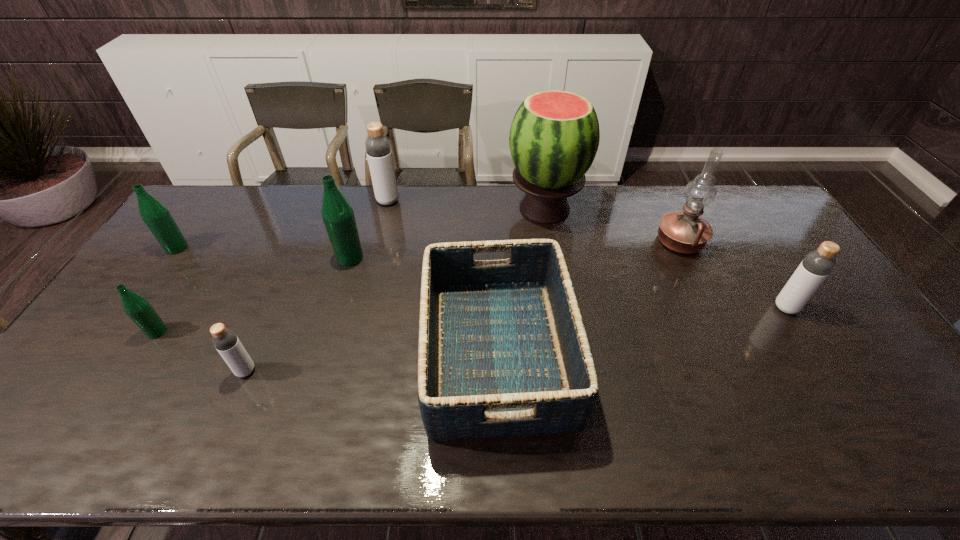
The width and height of the screenshot is (960, 540). I want to click on vacant region at the far left corner of the desktop, so click(225, 187).

Identify the location of vacant position at the near right corner of the desktop. coord(881,425).

Where is `free area in between the basket and the oil lamp`? Image resolution: width=960 pixels, height=540 pixels. free area in between the basket and the oil lamp is located at coordinates (588, 298).

At what (x,y) coordinates should I click in order to perform the action: click on free area in between the rightmost green bottle and the watermelon. Please return your answer as a coordinate pair (x, y). Image resolution: width=960 pixels, height=540 pixels. Looking at the image, I should click on (447, 233).

Where is `unoccupied area between the biggest green bottle and the nearest bottle`? This screenshot has height=540, width=960. unoccupied area between the biggest green bottle and the nearest bottle is located at coordinates click(298, 314).

Where is `vacant space that's between the green watermelon and the rightmost bottle`? This screenshot has height=540, width=960. vacant space that's between the green watermelon and the rightmost bottle is located at coordinates (665, 258).

Where is `free space between the eighth object from left to right and the green watermelon`? free space between the eighth object from left to right and the green watermelon is located at coordinates (612, 226).

This screenshot has width=960, height=540. Identify the location of free space between the leftmost green bottle and the fourth bottle from right to left. (211, 309).

This screenshot has height=540, width=960. In order to click on free spot between the watermelon and the third bottle from left to right in this screenshot , I will do `click(396, 290)`.

Locate an element on the screen. The width and height of the screenshot is (960, 540). free spot between the leftmost bottle and the green watermelon is located at coordinates click(361, 228).